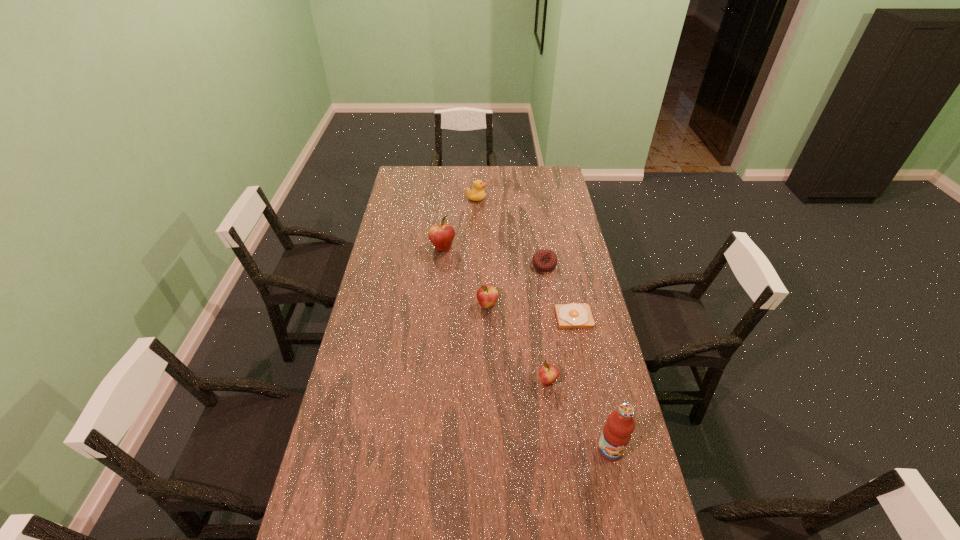
At what (x,y) coordinates should I click in order to perform the action: click on apple identified as the closest to the farthest apple. Please return your answer as a coordinate pair (x, y). This screenshot has width=960, height=540. Looking at the image, I should click on (487, 295).

Point out which apple is positioned as the nearest to the farthest object. Please provide its 2D coordinates. Your answer should be formatted as a tuple, i.e. [(x, y)], where the tuple contains the x and y coordinates of a point satisfying the conditions above.

[(441, 235)]

Locate an element on the screen. This screenshot has height=540, width=960. free space that satisfies the following two spatial constraints: 1. at the beak of the duck; 2. on the left side of the beanbag is located at coordinates (475, 265).

You are a GUI agent. You are given a task and a screenshot of the screen. Output one action in this format:
    pyautogui.click(x=<x>, y=<y>)
    Task: Click on the vacant space that satisfies the following two spatial constraints: 1. at the beak of the second farthest apple; 2. on the left side of the farthest object
    
    Given the screenshot: What is the action you would take?
    pyautogui.click(x=474, y=305)

Image resolution: width=960 pixels, height=540 pixels. I want to click on blank space that satisfies the following two spatial constraints: 1. at the beak of the beanbag; 2. on the right side of the farthest object, so click(475, 265).

At what (x,y) coordinates should I click in order to perform the action: click on vacant area that satisfies the following two spatial constraints: 1. on the front side of the second tallest apple; 2. on the right side of the shortest object. Please return your answer as a coordinate pair (x, y). The height and width of the screenshot is (540, 960). Looking at the image, I should click on (488, 317).